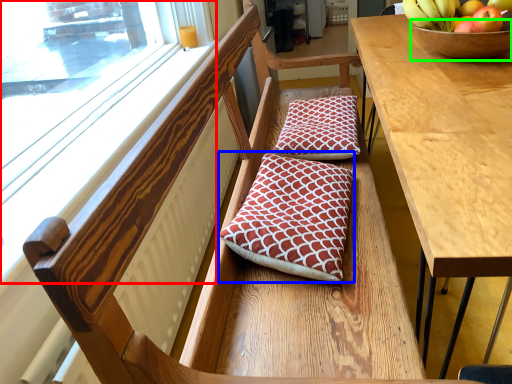
Question: Which is nearer to the window (highlighted by a red box)? pillow (highlighted by a blue box) or glass bowl (highlighted by a green box).

Choices:
 (A) pillow
 (B) glass bowl

Answer: (A)